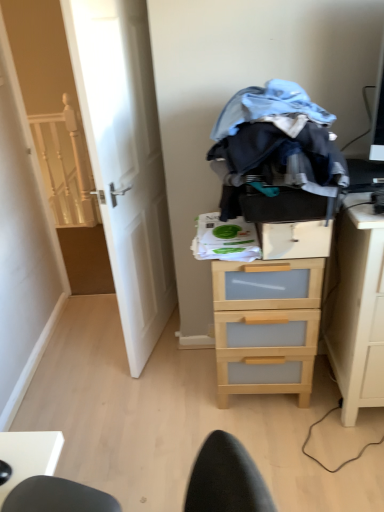
Question: From a real-world perspective, is wooden drawer at center below light wood/transparent drawer at center?

Choices:
 (A) yes
 (B) no

Answer: (B)

Question: Can you confirm if wooden drawer at center is shorter than light wood/transparent drawer at center?

Choices:
 (A) yes
 (B) no

Answer: (A)

Question: Does wooden drawer at center appear on the right side of light wood/transparent drawer at center?

Choices:
 (A) yes
 (B) no

Answer: (A)

Question: Is light wood/transparent drawer at center a part of wooden drawer at center?

Choices:
 (A) yes
 (B) no

Answer: (B)

Question: Is wooden drawer at center in contact with light wood/transparent drawer at center?

Choices:
 (A) yes
 (B) no

Answer: (B)

Question: Visually, is white wooden stairwell at left positioned to the left or to the right of light wood/transparent drawer at right?

Choices:
 (A) left
 (B) right

Answer: (A)

Question: Is white wooden stairwell at left taller or shorter than light wood/transparent drawer at right?

Choices:
 (A) tall
 (B) short

Answer: (A)

Question: Is white wooden stairwell at left bigger or smaller than light wood/transparent drawer at right?

Choices:
 (A) small
 (B) big

Answer: (A)

Question: From the image's perspective, is white wooden stairwell at left located above or below light wood/transparent drawer at right?

Choices:
 (A) above
 (B) below

Answer: (A)

Question: From the image's perspective, is light wood/transparent drawer at right located above or below light wood/transparent drawer at center?

Choices:
 (A) above
 (B) below

Answer: (A)

Question: In terms of size, does light wood/transparent drawer at right appear bigger or smaller than light wood/transparent drawer at center?

Choices:
 (A) big
 (B) small

Answer: (A)

Question: Is point (360, 210) closer or farther from the camera than point (274, 365)?

Choices:
 (A) farther
 (B) closer

Answer: (B)

Question: Is light wood/transparent drawer at right situated inside light wood/transparent drawer at center or outside?

Choices:
 (A) outside
 (B) inside

Answer: (A)

Question: Considering the positions of white wooden stairwell at left and white wooden door at left in the image, is white wooden stairwell at left wider or thinner than white wooden door at left?

Choices:
 (A) wide
 (B) thin

Answer: (B)

Question: Is white wooden stairwell at left to the left or to the right of white wooden door at left in the image?

Choices:
 (A) right
 (B) left

Answer: (B)